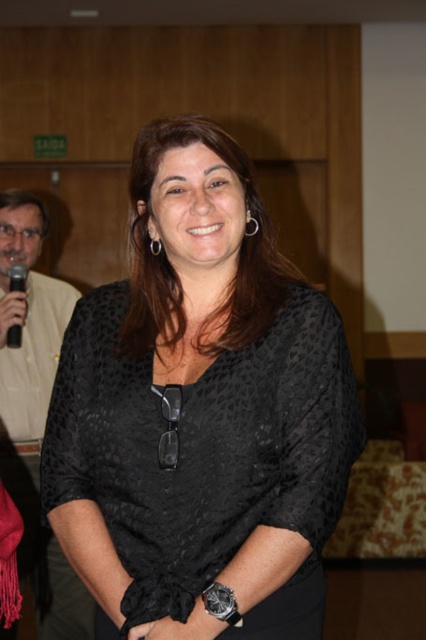
Does matte beige shirt at left have a lesser height compared to black plastic microphone at left?

Incorrect, matte beige shirt at left's height does not fall short of black plastic microphone at left's.

Does matte beige shirt at left have a larger size compared to black plastic microphone at left?

Correct, matte beige shirt at left is larger in size than black plastic microphone at left.

Identify the location of matte beige shirt at left. (34, 410).

The width and height of the screenshot is (426, 640). I want to click on matte beige shirt at left, so click(x=34, y=410).

Between black dotted blouse at center and black plastic microphone at left, which one has more height?

Standing taller between the two is black dotted blouse at center.

Can you confirm if black dotted blouse at center is positioned above black plastic microphone at left?

No, black dotted blouse at center is not above black plastic microphone at left.

Is point (282, 545) farther from viewer compared to point (5, 342)?

No, it is in front of (5, 342).

I want to click on black dotted blouse at center, so click(201, 413).

Does black dotted blouse at center have a smaller size compared to matte beige shirt at left?

Indeed, black dotted blouse at center has a smaller size compared to matte beige shirt at left.

Is point (253, 560) closer to camera compared to point (8, 396)?

Yes, it is.

Where is `black dotted blouse at center`? black dotted blouse at center is located at coordinates (201, 413).